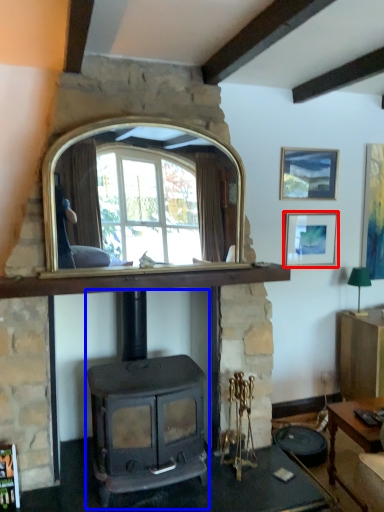
Question: Which of the following is the farthest to the observer, picture frame (highlighted by a red box) or wood burning stove (highlighted by a blue box)?

Choices:
 (A) picture frame
 (B) wood burning stove

Answer: (A)